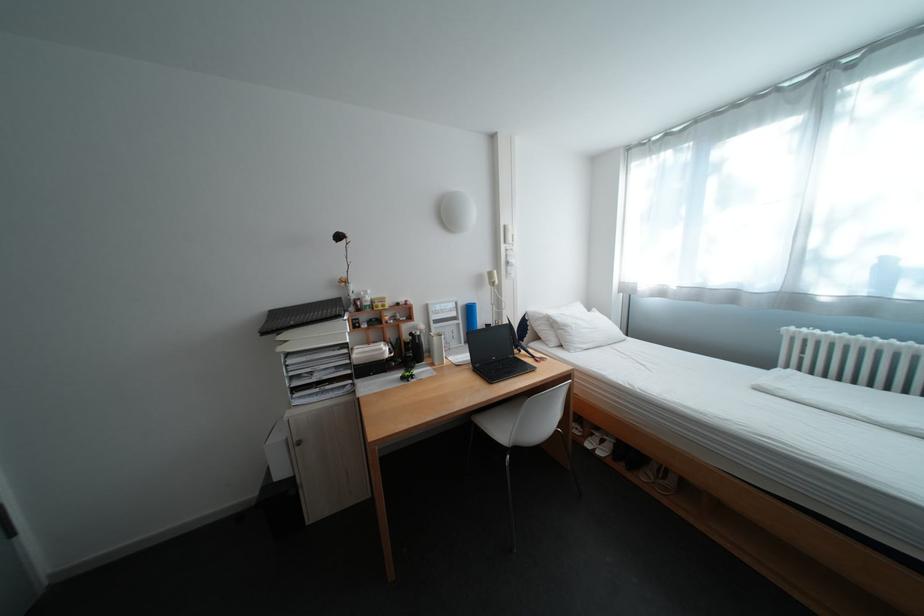
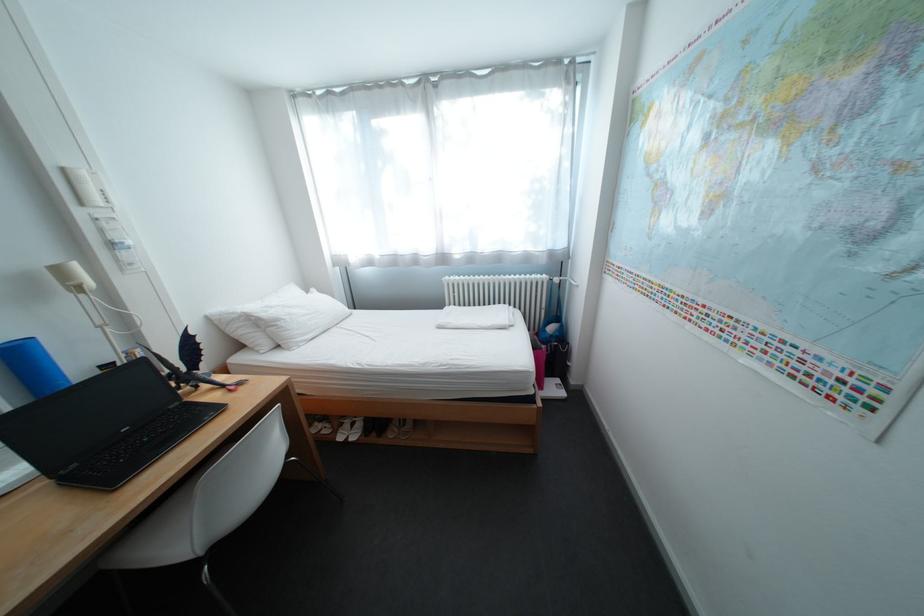
In the second image, find the point that corresponds to (x=805, y=329) in the first image.

(459, 278)